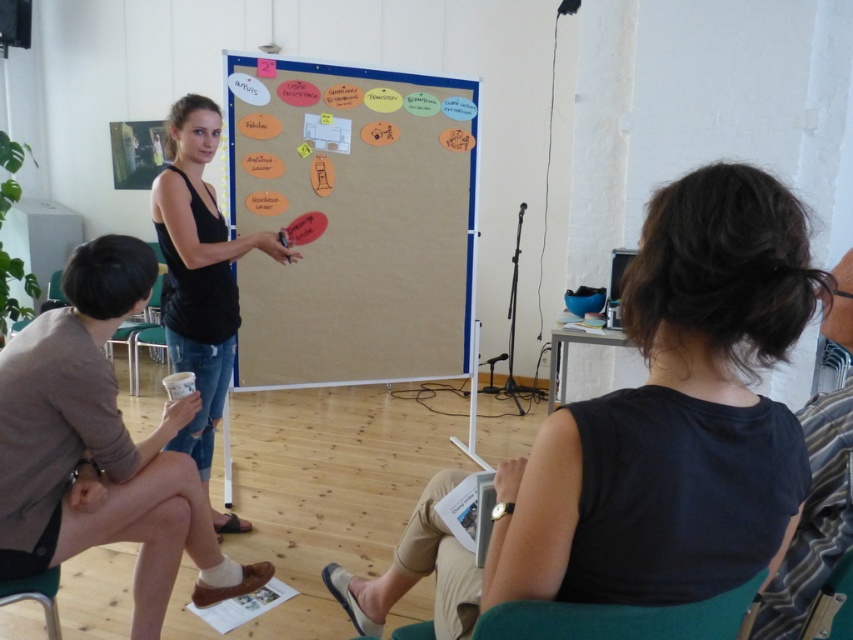
Is brown leather shoes at lower left smaller than black matte tank top at center?

Indeed, brown leather shoes at lower left has a smaller size compared to black matte tank top at center.

Identify the location of brown leather shoes at lower left. The width and height of the screenshot is (853, 640). (100, 448).

Who is taller, brown leather shoes at lower left or striped fabric shirt at right?

brown leather shoes at lower left

From the picture: Who is positioned more to the left, brown leather shoes at lower left or striped fabric shirt at right?

From the viewer's perspective, brown leather shoes at lower left appears more on the left side.

What do you see at coordinates (100, 448) in the screenshot? The image size is (853, 640). I see `brown leather shoes at lower left` at bounding box center [100, 448].

Identify the location of brown leather shoes at lower left. (100, 448).

Does point (801, 576) lie in front of point (730, 634)?

No, it is behind (730, 634).

Does striped fabric shirt at right have a smaller size compared to green fabric chair at lower center?

Incorrect, striped fabric shirt at right is not smaller in size than green fabric chair at lower center.

The image size is (853, 640). Find the location of `striped fabric shirt at right`. striped fabric shirt at right is located at coordinates (813, 516).